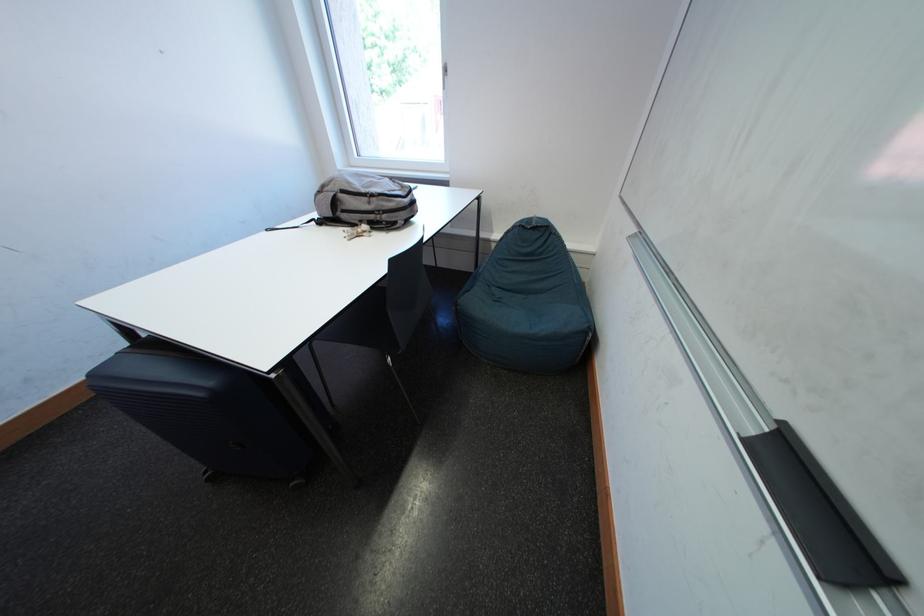
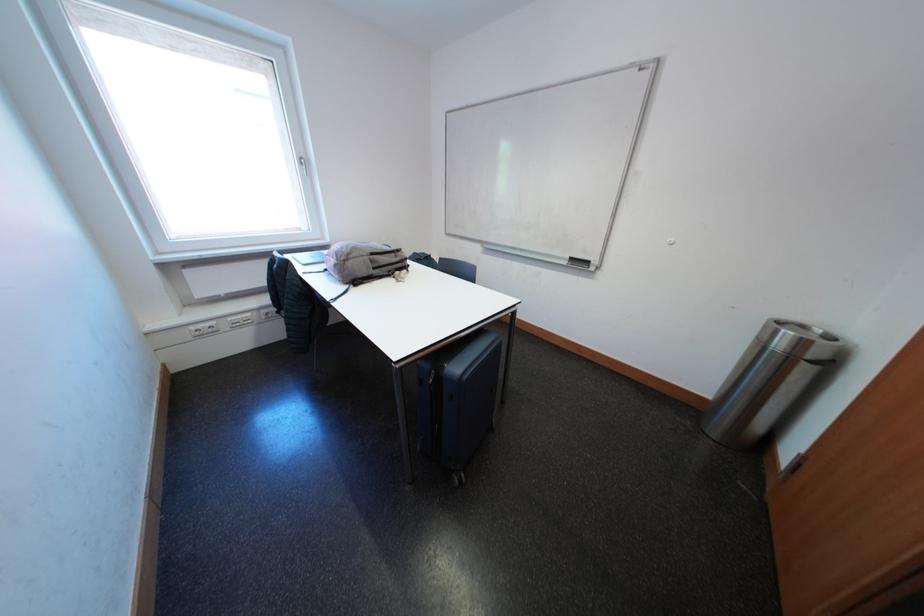
The point at (379, 207) is marked in the first image. Where is the corresponding point in the second image?

(406, 261)